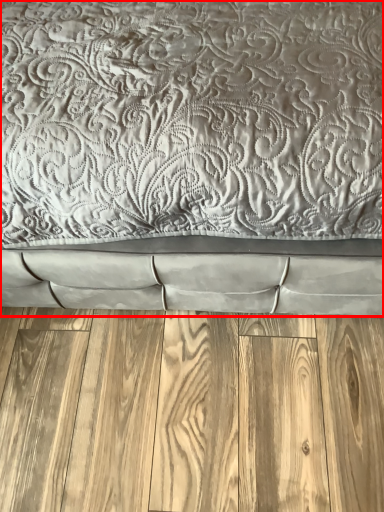
Question: Considering the relative positions of bed (annotated by the red box) and hardwood in the image provided, where is bed (annotated by the red box) located with respect to the staircase?

Choices:
 (A) right
 (B) left

Answer: (A)